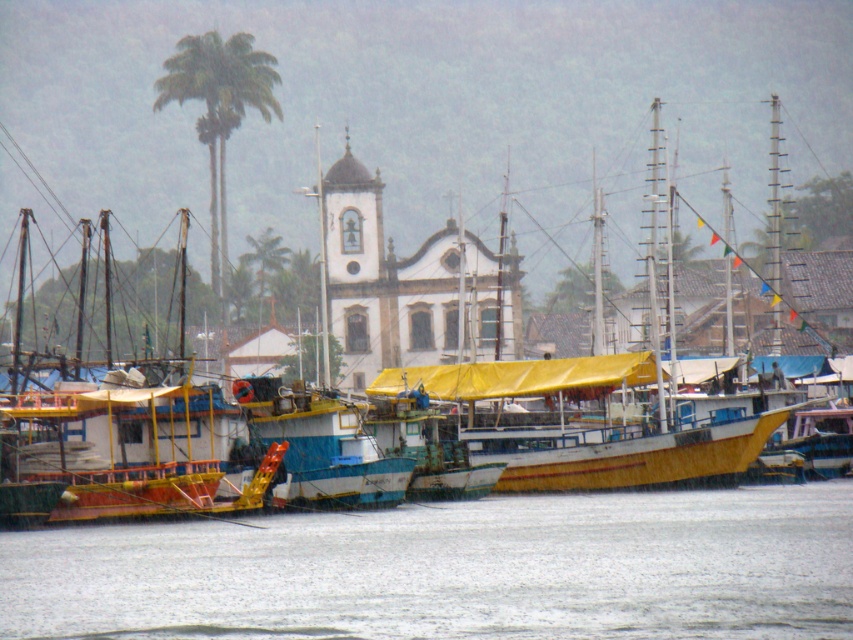
Who is higher up, transparent water at lower center or green leafy palm tree at upper left?

green leafy palm tree at upper left is higher up.

Is point (570, 620) farther from viewer compared to point (252, 90)?

No.

Is point (737, 515) more distant than point (184, 35)?

No.

Where is `transparent water at lower center`? This screenshot has width=853, height=640. transparent water at lower center is located at coordinates pyautogui.click(x=454, y=570).